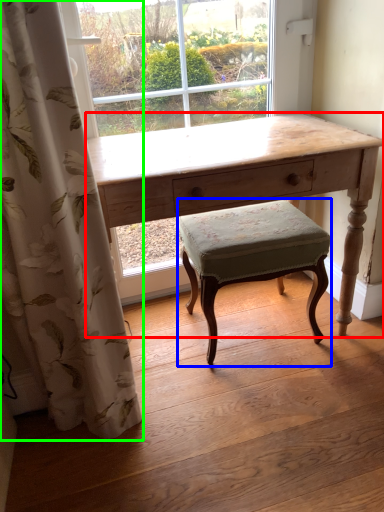
Question: Which is farther away from desk (highlighted by a red box)? stool (highlighted by a blue box) or curtain (highlighted by a green box)?

Choices:
 (A) stool
 (B) curtain

Answer: (B)